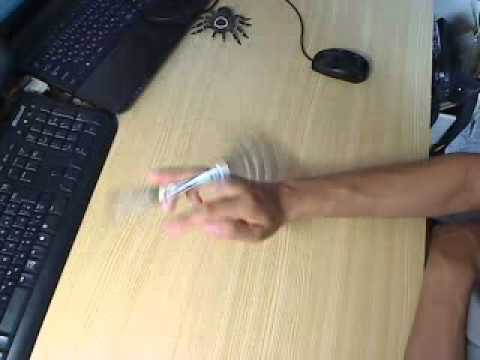
What are the coordinates of `desktop` in the screenshot? It's located at (322, 121).